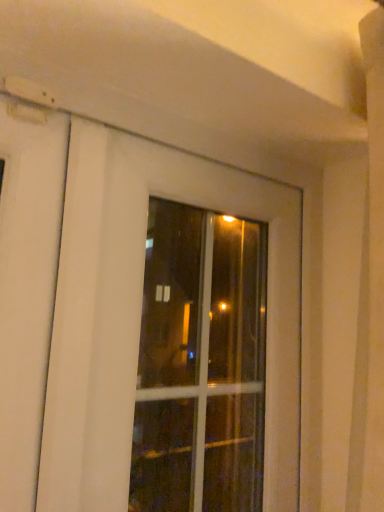
This screenshot has width=384, height=512. What do you see at coordinates (140, 314) in the screenshot?
I see `white glass door at center` at bounding box center [140, 314].

This screenshot has height=512, width=384. Identify the location of white glass door at center. pyautogui.click(x=140, y=314).

Find the location of a particular element. white glass door at center is located at coordinates (140, 314).